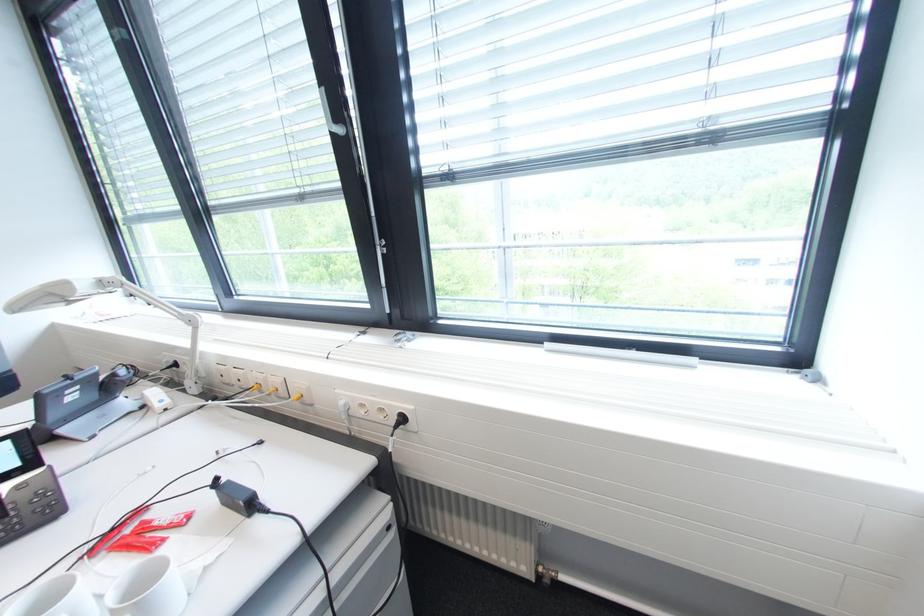
Where is `radiator valve knob`? radiator valve knob is located at coordinates (545, 573).